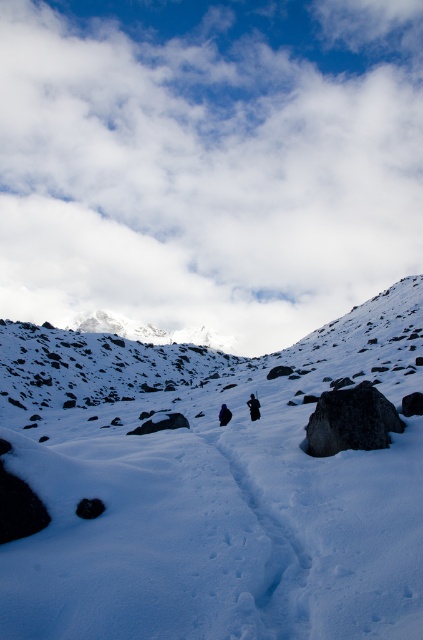
Question: Is black matte jacket at center above black fabric person at center?

Choices:
 (A) yes
 (B) no

Answer: (A)

Question: Can you confirm if dark gray rock at center is bigger than black matte jacket at center?

Choices:
 (A) no
 (B) yes

Answer: (B)

Question: Which point is farther from the camera taking this photo?

Choices:
 (A) (368, 589)
 (B) (253, 394)
 (C) (222, 416)
 (D) (387, 401)

Answer: (B)

Question: Is dark gray rock at center smaller than black matte jacket at center?

Choices:
 (A) no
 (B) yes

Answer: (A)

Question: Among these objects, which one is nearest to the camera?

Choices:
 (A) black matte jacket at center
 (B) dark gray rock at center

Answer: (B)

Question: Which point is farther from the camera taking this photo?

Choices:
 (A) (386, 404)
 (B) (255, 404)
 (C) (219, 413)

Answer: (C)